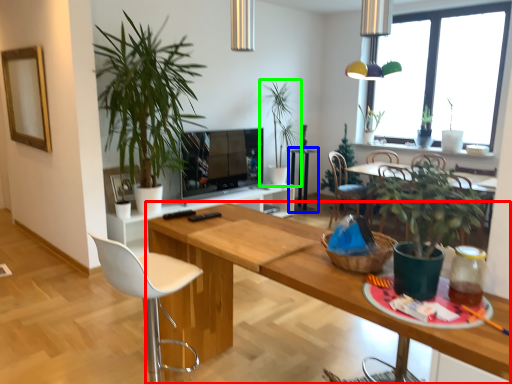
Question: Estimate the real-world distances between objects in this image. Which object is farther from table (highlighted by a red box), side table (highlighted by a blue box) or houseplant (highlighted by a green box)?

Choices:
 (A) side table
 (B) houseplant

Answer: (A)